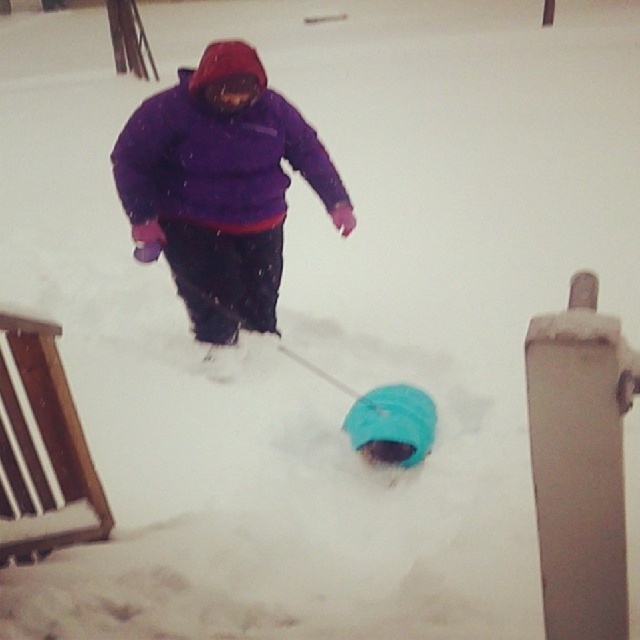
Question: Is purple fleece jacket at center to the left of matte blue snow tube at center from the viewer's perspective?

Choices:
 (A) yes
 (B) no

Answer: (A)

Question: Is purple fleece jacket at center thinner than matte blue snow tube at center?

Choices:
 (A) yes
 (B) no

Answer: (B)

Question: Among these objects, which one is farthest from the camera?

Choices:
 (A) matte blue snow tube at center
 (B) purple fleece jacket at center

Answer: (B)

Question: Which object appears closest to the camera in this image?

Choices:
 (A) matte blue snow tube at center
 (B) purple fleece jacket at center

Answer: (A)

Question: Does purple fleece jacket at center come behind matte blue snow tube at center?

Choices:
 (A) no
 (B) yes

Answer: (B)